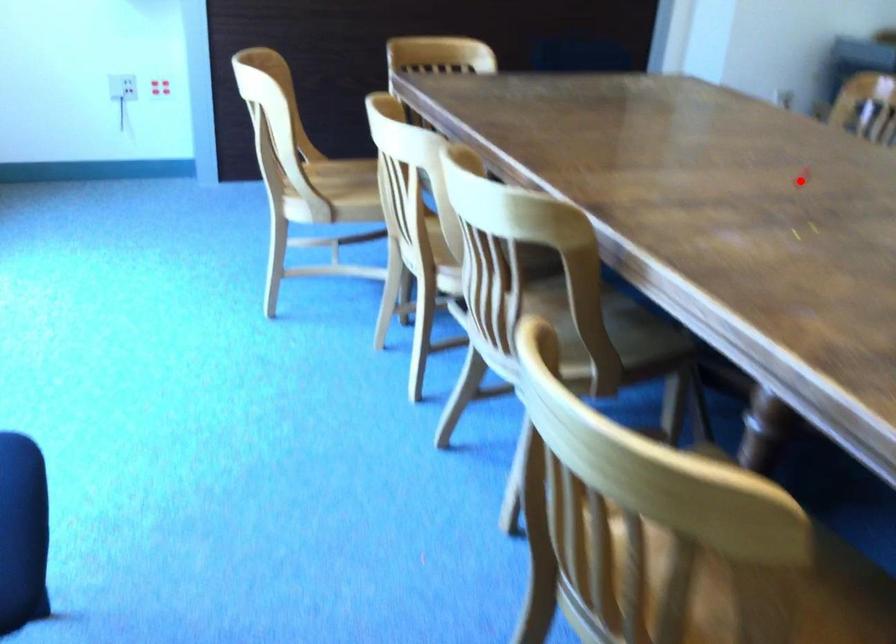
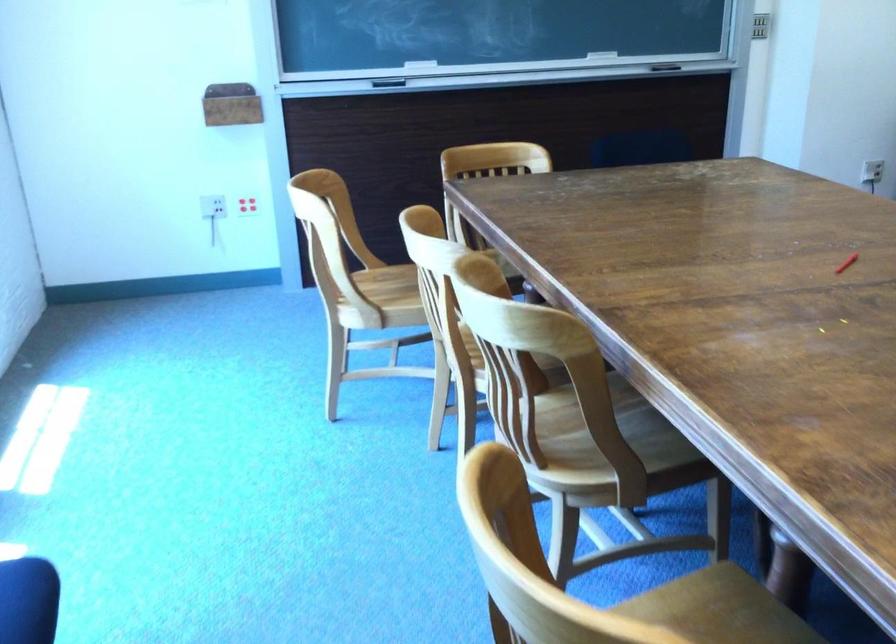
In the second image, find the point that corresponds to the highlighted location in the first image.

(846, 263)